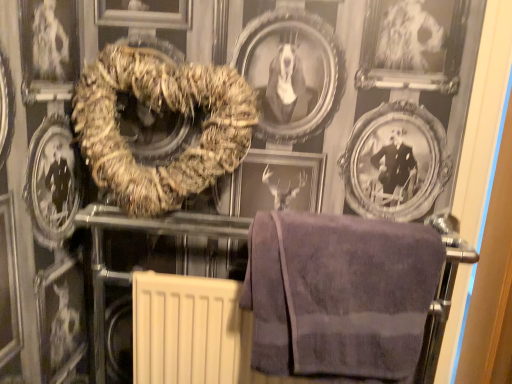
Question: Which direction should I rotate to look at brown textured towel at center, positioned as the first towel in top-to-bottom order?

Choices:
 (A) left
 (B) right

Answer: (A)

Question: Can you confirm if brown textured towel at center, positioned as the first towel in top-to-bottom order, is wider than purple terry cloth towel at lower right, which appears as the 1th towel when viewed from the right?

Choices:
 (A) yes
 (B) no

Answer: (B)

Question: Does brown textured towel at center, arranged as the first towel when viewed from the left, lie behind purple terry cloth towel at lower right, which appears as the 1th towel when ordered from the bottom?

Choices:
 (A) no
 (B) yes

Answer: (B)

Question: Is brown textured towel at center, arranged as the first towel when viewed from the left, with purple terry cloth towel at lower right, placed as the second towel when sorted from top to bottom?

Choices:
 (A) yes
 (B) no

Answer: (B)

Question: From a real-world perspective, is brown textured towel at center, positioned as the first towel in top-to-bottom order, physically below purple terry cloth towel at lower right, which is counted as the 2th towel, starting from the left?

Choices:
 (A) no
 (B) yes

Answer: (A)

Question: Is brown textured towel at center, marked as the second towel in a bottom-to-top arrangement, bigger than purple terry cloth towel at lower right, which is counted as the 2th towel, starting from the left?

Choices:
 (A) no
 (B) yes

Answer: (B)

Question: Does brown textured towel at center, arranged as the first towel when viewed from the left, appear on the left side of purple terry cloth towel at lower right, which is counted as the 2th towel, starting from the left?

Choices:
 (A) no
 (B) yes

Answer: (B)

Question: Is purple terry cloth towel at lower right, placed as the second towel when sorted from top to bottom, facing towards brown textured towel at center, marked as the second towel in a bottom-to-top arrangement?

Choices:
 (A) yes
 (B) no

Answer: (B)

Question: Is purple terry cloth towel at lower right, placed as the second towel when sorted from top to bottom, bigger than brown textured towel at center, which appears as the second towel when viewed from the right?

Choices:
 (A) yes
 (B) no

Answer: (B)

Question: Can you confirm if purple terry cloth towel at lower right, which is counted as the 2th towel, starting from the left, is shorter than brown textured towel at center, positioned as the first towel in top-to-bottom order?

Choices:
 (A) yes
 (B) no

Answer: (A)

Question: From the image's perspective, is purple terry cloth towel at lower right, which is counted as the 2th towel, starting from the left, over brown textured towel at center, arranged as the first towel when viewed from the left?

Choices:
 (A) yes
 (B) no

Answer: (B)

Question: Considering the relative sizes of purple terry cloth towel at lower right, which appears as the 1th towel when ordered from the bottom, and brown textured towel at center, positioned as the first towel in top-to-bottom order, in the image provided, is purple terry cloth towel at lower right, which appears as the 1th towel when ordered from the bottom, thinner than brown textured towel at center, positioned as the first towel in top-to-bottom order,?

Choices:
 (A) yes
 (B) no

Answer: (B)

Question: Is brown textured towel at center, arranged as the first towel when viewed from the left, inside purple terry cloth towel at lower right, placed as the second towel when sorted from top to bottom?

Choices:
 (A) no
 (B) yes

Answer: (A)

Question: Is point (416, 263) positioned closer to the camera than point (136, 54)?

Choices:
 (A) closer
 (B) farther

Answer: (A)